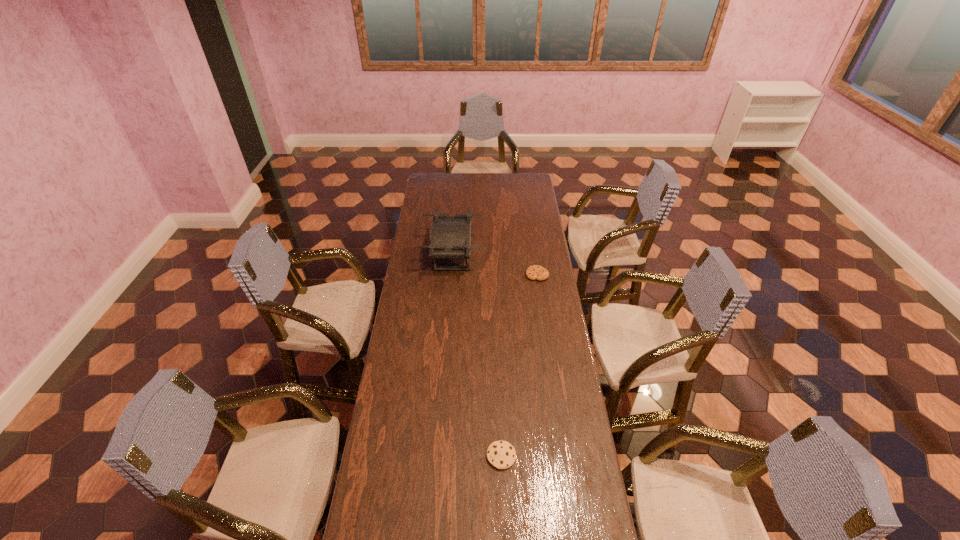
The width and height of the screenshot is (960, 540). I want to click on the leftmost object, so click(x=450, y=236).

You are a GUI agent. You are given a task and a screenshot of the screen. Output one action in this format:
    pyautogui.click(x=<x>, y=<y>)
    Task: Click on the drone
    
    Given the screenshot: What is the action you would take?
    pyautogui.click(x=450, y=236)

In order to click on the second object from left to right in this screenshot , I will do `click(501, 454)`.

Where is `the nearest object`? Image resolution: width=960 pixels, height=540 pixels. the nearest object is located at coordinates (501, 454).

The image size is (960, 540). I want to click on the farther cookie, so click(535, 272).

The image size is (960, 540). Identify the location of the rightmost object. (535, 272).

Find the location of a particular element. Image resolution: width=960 pixels, height=540 pixels. vacant point located with a camera mounted on the underside of the drone is located at coordinates (518, 256).

Locate an element on the screen. The height and width of the screenshot is (540, 960). vacant region located on the front of the left cookie is located at coordinates (502, 489).

Where is `vacant space located 0.100m on the left of the right cookie`? The image size is (960, 540). vacant space located 0.100m on the left of the right cookie is located at coordinates (505, 275).

Find the location of `object positioned at the left edge`. object positioned at the left edge is located at coordinates (450, 236).